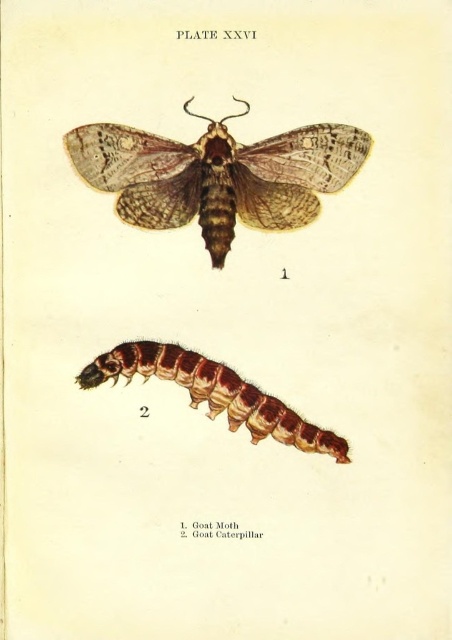
You are examining the scientific illustration labeled PLATE XXVI. You notice the brown textured moth at upper center and the brown fuzzy caterpillar at lower center. Which of these two insects is positioned closer to your viewpoint?

The brown textured moth at upper center is closer to the viewer than the brown fuzzy caterpillar at lower center.

Based on the coordinates provided in the illustration, which point is closer to the viewer, point (221, 161) or point (244, 413)?

Point (221, 161) is in front of point (244, 413), so it is closer to the viewer.